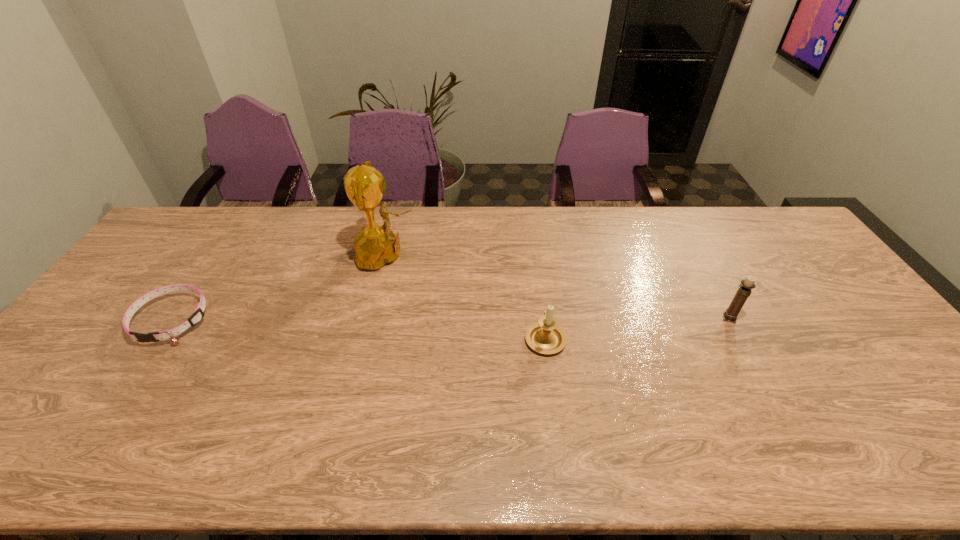
Where is `object that stands as the closest to the shortest object`? object that stands as the closest to the shortest object is located at coordinates (376, 245).

Choose which object is the third nearest neighbor to the farthest object. Please provide its 2D coordinates. Your answer should be formatted as a tuple, i.e. [(x, y)], where the tuple contains the x and y coordinates of a point satisfying the conditions above.

[(745, 288)]

This screenshot has height=540, width=960. Identify the location of free location that satisfies the following two spatial constraints: 1. on the front side of the tallest object; 2. with a handle on the side of the shorter candle holder. (367, 338).

I want to click on vacant area in the image that satisfies the following two spatial constraints: 1. on the front side of the farthest object; 2. with a handle on the side of the left candle holder, so click(367, 338).

The height and width of the screenshot is (540, 960). What are the coordinates of `free space that satisfies the following two spatial constraints: 1. on the front side of the second object from left to right; 2. with a handle on the side of the shorter candle holder` in the screenshot? It's located at (367, 338).

I want to click on vacant area that satisfies the following two spatial constraints: 1. on the front side of the third object from right to left; 2. with the buckle on the shortest object, so click(372, 320).

Find the location of a particular element. vacant space that satisfies the following two spatial constraints: 1. on the front side of the award; 2. with a handle on the side of the shorter candle holder is located at coordinates (367, 338).

Locate an element on the screen. Image resolution: width=960 pixels, height=540 pixels. free point that satisfies the following two spatial constraints: 1. on the front side of the rightmost object; 2. on the right side of the award is located at coordinates click(x=372, y=318).

Find the location of a particular element. vacant space that satisfies the following two spatial constraints: 1. on the front side of the award; 2. with a handle on the side of the third tallest object is located at coordinates (367, 338).

At what (x,y) coordinates should I click in order to perform the action: click on vacant position in the image that satisfies the following two spatial constraints: 1. on the front side of the farthest object; 2. with the buckle on the shortest object. Please return your answer as a coordinate pair (x, y). Image resolution: width=960 pixels, height=540 pixels. Looking at the image, I should click on (372, 320).